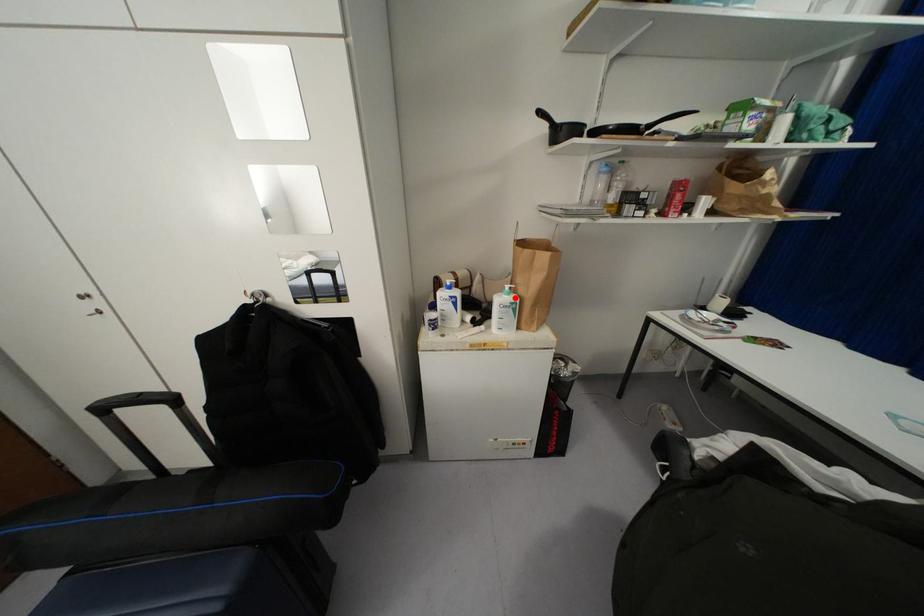
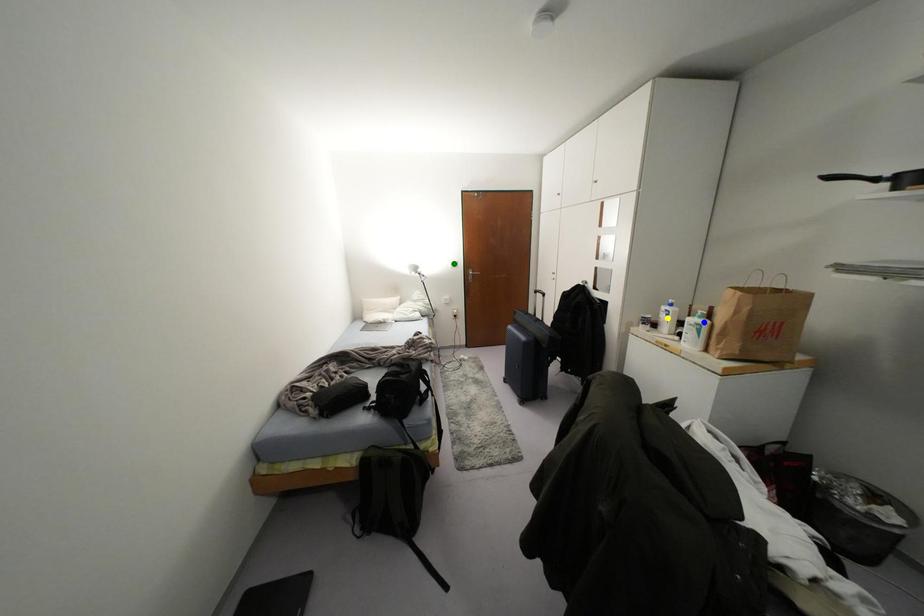
Question: I am providing you with two images of the same scene from different viewpoints. A red point is marked on the first image. You are given multiple points on the second image. Which mark in image 2 goes with the point in image 1?

Choices:
 (A) blue point
 (B) green point
 (C) yellow point

Answer: (A)